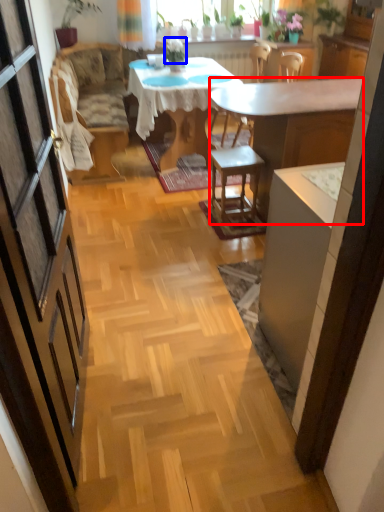
Question: Which of the following is the farthest to the observer, desk (highlighted by a red box) or plant (highlighted by a blue box)?

Choices:
 (A) desk
 (B) plant

Answer: (B)